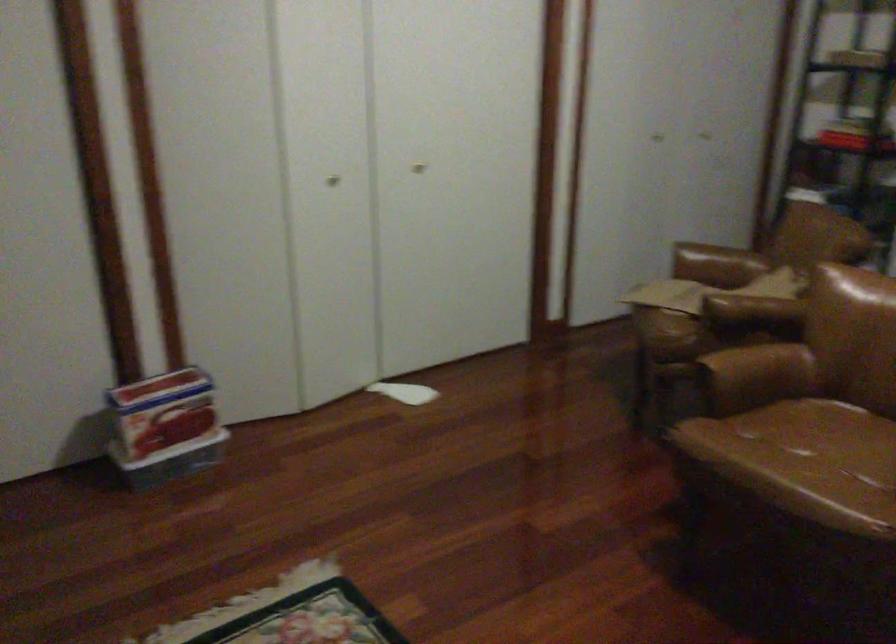
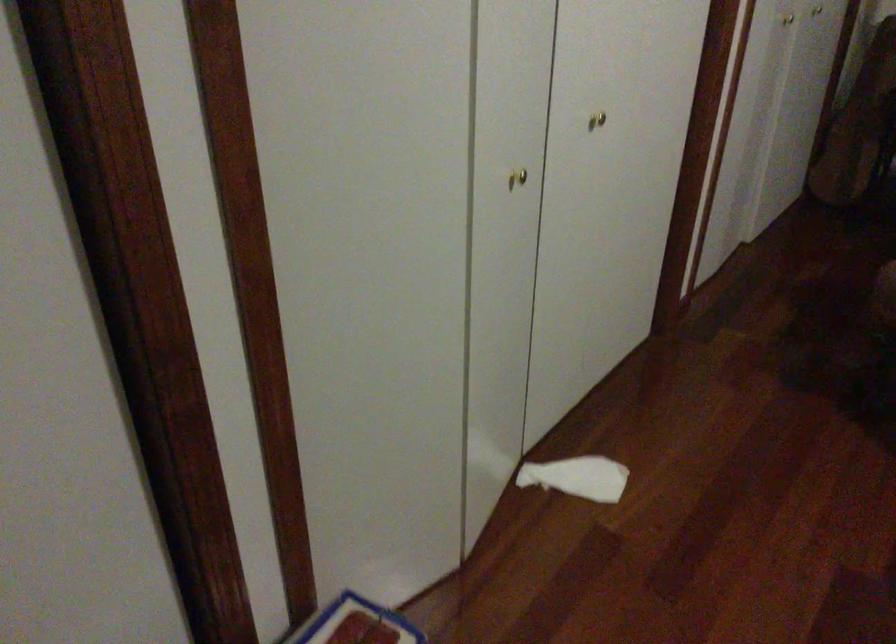
Locate, in the second image, the point that corresponds to [431,167] in the first image.

(597, 120)